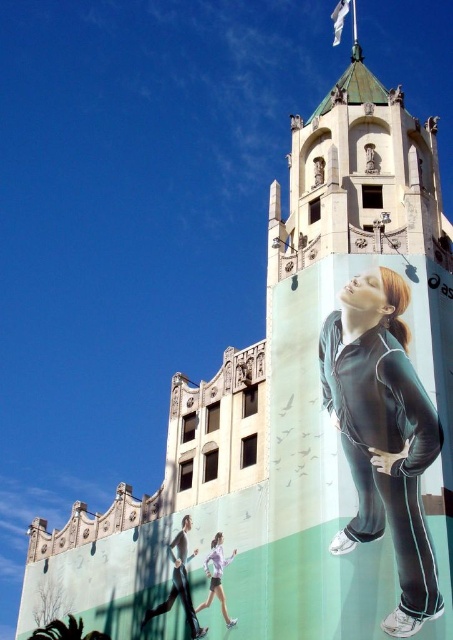
Question: Considering the real-world distances, which object is farthest from the light purple fabric at lower center?

Choices:
 (A) matte black tracksuit at right
 (B) black fabric pants at lower left

Answer: (A)

Question: Does black fabric pants at lower left have a greater width compared to light purple fabric at lower center?

Choices:
 (A) no
 (B) yes

Answer: (B)

Question: Can you confirm if matte black tracksuit at right is wider than black fabric pants at lower left?

Choices:
 (A) no
 (B) yes

Answer: (B)

Question: Can you confirm if matte black tracksuit at right is positioned to the left of light purple fabric at lower center?

Choices:
 (A) no
 (B) yes

Answer: (A)

Question: Which of these objects is positioned closest to the matte black tracksuit at right?

Choices:
 (A) light purple fabric at lower center
 (B) black fabric pants at lower left

Answer: (A)

Question: Which point is closer to the camera?

Choices:
 (A) black fabric pants at lower left
 (B) matte black tracksuit at right

Answer: (B)